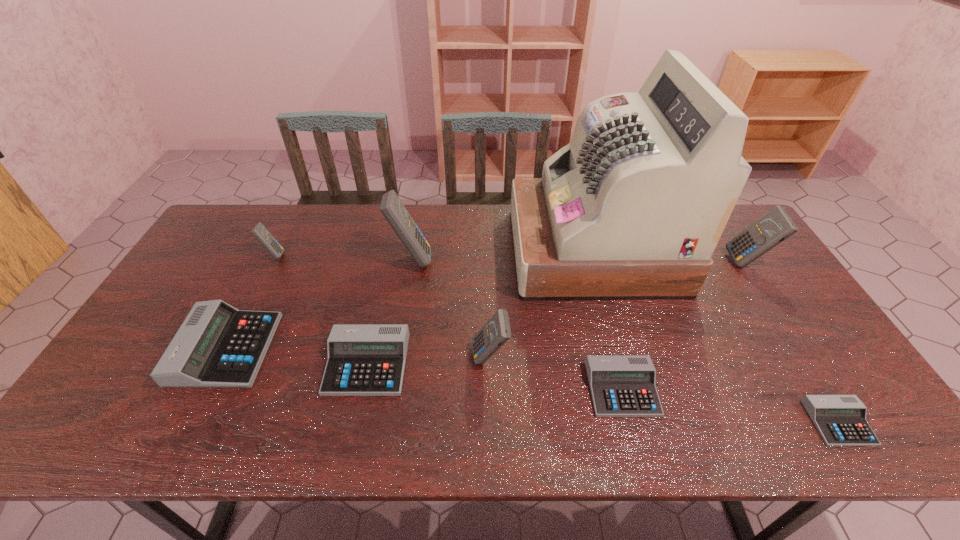
I want to click on blank space that satisfies the following two spatial constraints: 1. on the front side of the second smallest gray calculator; 2. on the right side of the shortest calculator, so click(631, 423).

Identify the location of free location that satisfies the following two spatial constraints: 1. on the front-facing side of the tallest calculator; 2. on the back side of the eighth tallest object. (389, 389).